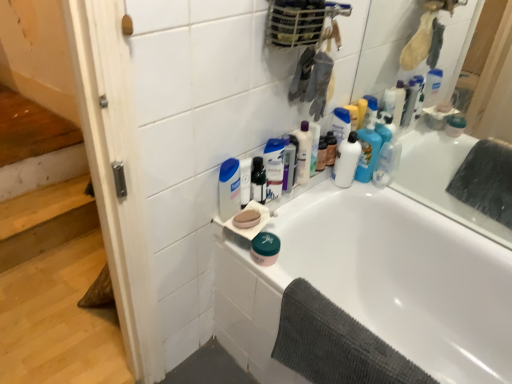
Where is `free point in front of white wood screen door at left`? This screenshot has width=512, height=384. free point in front of white wood screen door at left is located at coordinates (77, 354).